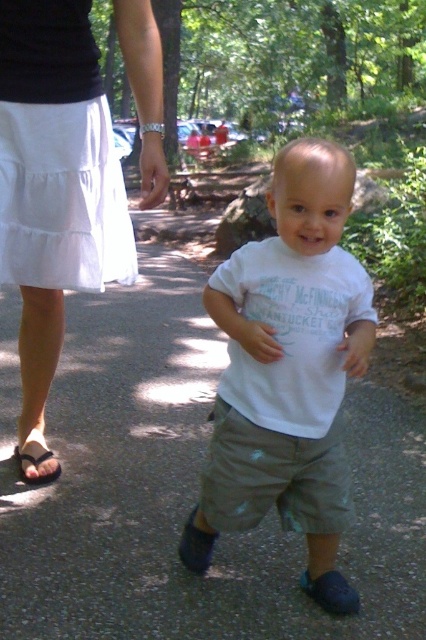
Locate an element on the screen. white fabric at center is located at coordinates (184, 486).

Does point (25, 499) come behind point (26, 476)?

That is False.

Is point (126, 336) positioned after point (25, 458)?

Yes, point (126, 336) is behind point (25, 458).

This screenshot has height=640, width=426. In order to click on white fabric at center in this screenshot , I will do `click(184, 486)`.

Who is more distant from viewer, (296, 387) or (25, 60)?

The point (25, 60) is behind.

Is white cotton shirt at center smaller than white cotton skirt at lower left?

Yes, white cotton shirt at center is smaller than white cotton skirt at lower left.

Who is more forward, (x=331, y=451) or (x=58, y=10)?

Positioned in front is point (x=331, y=451).

I want to click on white cotton shirt at center, so click(287, 371).

Is white cotton skirt at lower left thinner than brown leather sandal at lower left?

Incorrect, white cotton skirt at lower left's width is not less than brown leather sandal at lower left's.

Who is more distant from viewer, (43,339) or (25,458)?

The point (25,458) is more distant.

This screenshot has height=640, width=426. Identify the location of white cotton skirt at lower left. (43, 273).